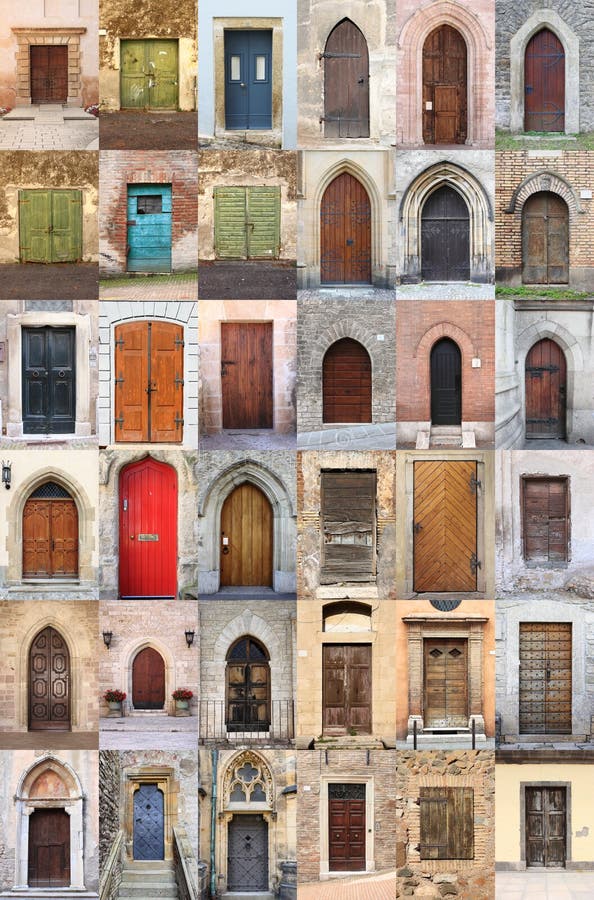
The image size is (594, 900). In order to click on blue doors in this screenshot , I will do `click(245, 90)`, `click(138, 240)`, `click(42, 387)`, `click(143, 820)`.